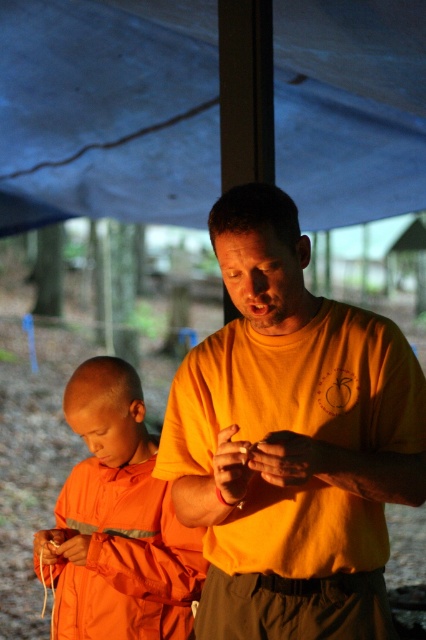
Is matte orange shirt at center in front of smooth orange monk at center?

Yes, it is.

Between point (305, 301) and point (88, 408), which one is positioned behind?

Positioned behind is point (88, 408).

At what (x,y) coordinates should I click in order to perform the action: click on matte orange shirt at center. Please return your answer as a coordinate pair (x, y). The height and width of the screenshot is (640, 426). Looking at the image, I should click on (264, 278).

Who is more distant from viewer, (112, 582) or (123, 433)?

Point (123, 433)

Is orange matte/soft fabric at left thinner than smooth orange monk at center?

No.

The height and width of the screenshot is (640, 426). Identify the location of orange matte/soft fabric at left. (118, 522).

Does orange matte/soft fabric at left have a larger size compared to matte orange shirt at center?

Yes.

Which of these two, orange matte/soft fabric at left or matte orange shirt at center, stands shorter?

With less height is matte orange shirt at center.

Does point (60, 611) come behind point (230, 273)?

Yes, it is.

Identify the location of orange matte/soft fabric at left. (118, 522).